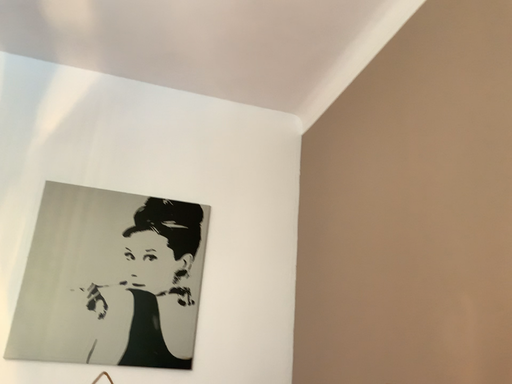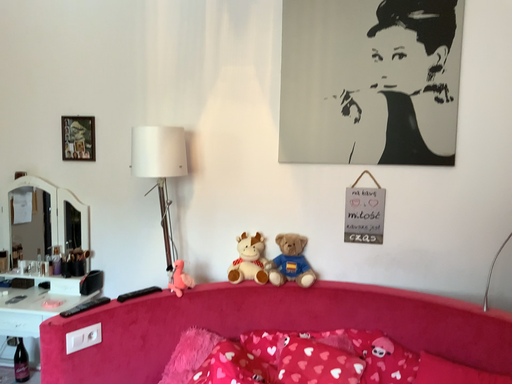
Question: How did the camera likely rotate when shooting the video?

Choices:
 (A) rotated right
 (B) rotated left

Answer: (B)